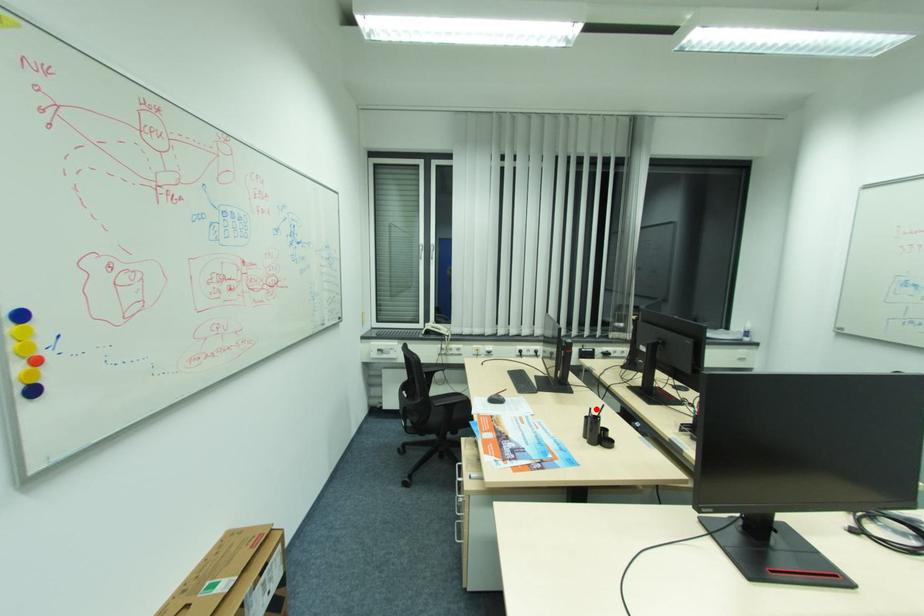
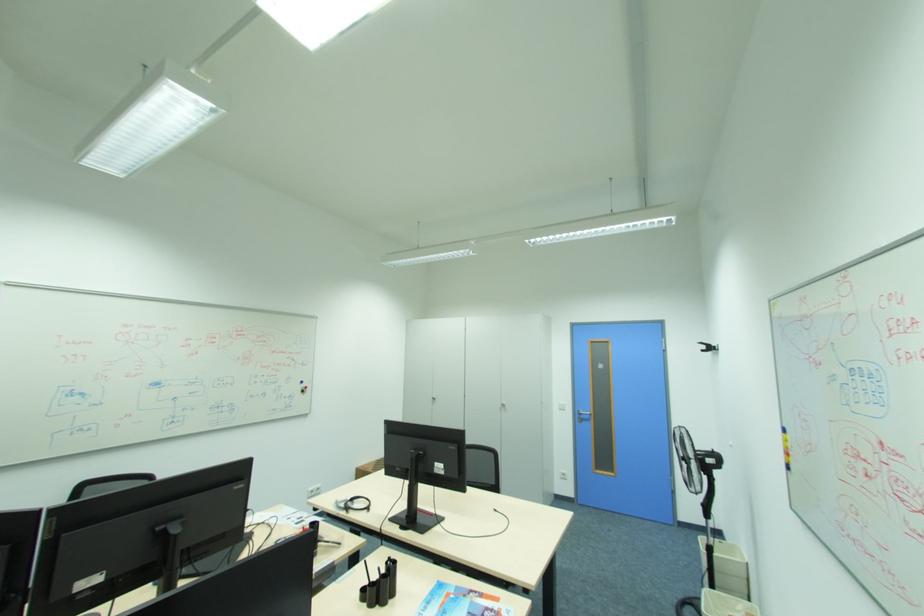
In the second image, find the point that corresponds to the highlighted location in the first image.

(383, 570)